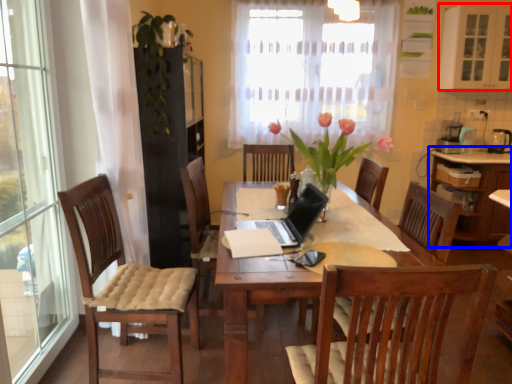
Question: Which of the following is the closest to the observer, cabinetry (highlighted by a red box) or cabinetry (highlighted by a blue box)?

Choices:
 (A) cabinetry
 (B) cabinetry

Answer: (A)